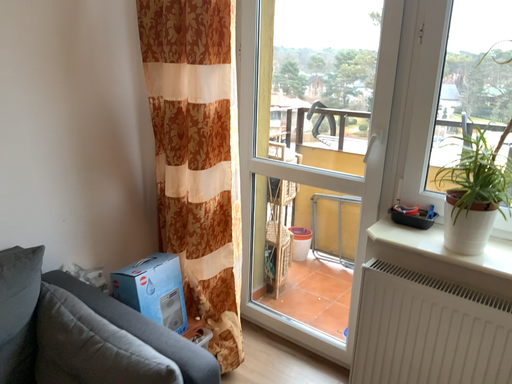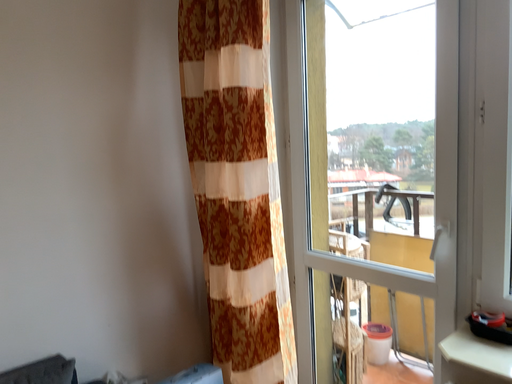
Question: Which way did the camera rotate in the video?

Choices:
 (A) rotated left
 (B) rotated right

Answer: (A)